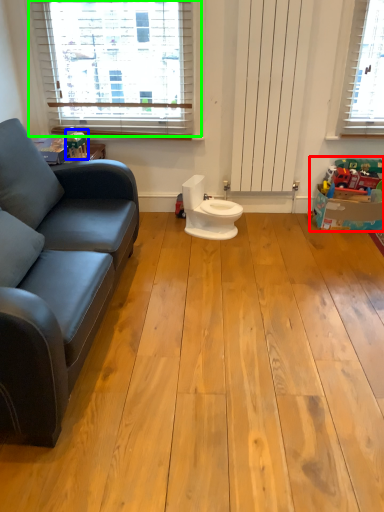
Question: Estimate the real-world distances between objects in this image. Which object is farther from toy (highlighted by a red box), toy (highlighted by a blue box) or window (highlighted by a green box)?

Choices:
 (A) toy
 (B) window

Answer: (A)